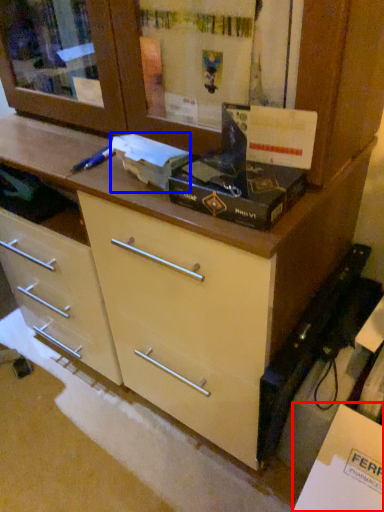
Question: Which object appears closest to the camera in this image, cabinetry (highlighted by a red box) or box (highlighted by a blue box)?

Choices:
 (A) cabinetry
 (B) box

Answer: (A)